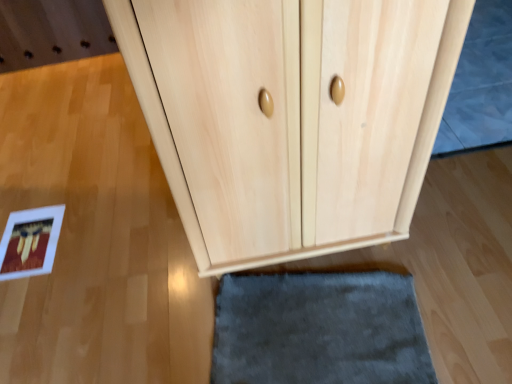
Locate an element on the screen. Image resolution: width=512 pixels, height=384 pixels. vacant space to the right of natural wood cupboard at center is located at coordinates pos(459,233).